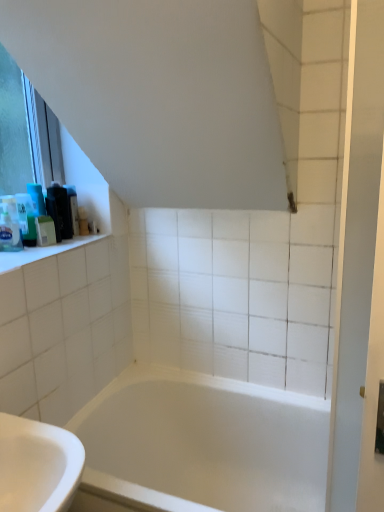
This screenshot has width=384, height=512. What do you see at coordinates (360, 274) in the screenshot? I see `white glossy screen door at right` at bounding box center [360, 274].

Find the location of a particular element. Image resolution: width=384 pixels, height=512 pixels. translucent plastic soap at upper left, which ranks as the first toiletry in front-to-back order is located at coordinates (9, 225).

Identify the location of white glossy bathtub at center. This screenshot has width=384, height=512. (201, 444).

Is the surface of white glossy screen door at right in direct contact with translucent plastic soap at upper left, the fifth toiletry when ordered from back to front?

No, white glossy screen door at right is not beside translucent plastic soap at upper left, the fifth toiletry when ordered from back to front.

Is white glossy screen door at right looking in the opposite direction of translucent plastic soap at upper left, the fifth toiletry when ordered from back to front?

white glossy screen door at right does not have its back to translucent plastic soap at upper left, the fifth toiletry when ordered from back to front.

Considering the sizes of white glossy screen door at right and translucent plastic soap at upper left, the fifth toiletry when ordered from back to front, in the image, is white glossy screen door at right bigger or smaller than translucent plastic soap at upper left, the fifth toiletry when ordered from back to front,?

Clearly, white glossy screen door at right is larger in size than translucent plastic soap at upper left, the fifth toiletry when ordered from back to front.

Considering the positions of objects white glossy screen door at right and translucent plastic soap at upper left, which ranks as the first toiletry in front-to-back order, in the image provided, who is more to the left, white glossy screen door at right or translucent plastic soap at upper left, which ranks as the first toiletry in front-to-back order,?

Positioned to the left is translucent plastic soap at upper left, which ranks as the first toiletry in front-to-back order.

Considering the positions of objects white glossy bathtub at center and matte black soap dispenser at upper left, the 5th toiletry in the front-to-back sequence, in the image provided, who is in front, white glossy bathtub at center or matte black soap dispenser at upper left, the 5th toiletry in the front-to-back sequence,?

white glossy bathtub at center is in front.

Consider the image. Could you tell me if white glossy bathtub at center is turned towards matte black soap dispenser at upper left, which appears as the first toiletry when viewed from the back?

No, white glossy bathtub at center does not turn towards matte black soap dispenser at upper left, which appears as the first toiletry when viewed from the back.

Do you think white glossy bathtub at center is within matte black soap dispenser at upper left, which appears as the first toiletry when viewed from the back, or outside of it?

white glossy bathtub at center is outside matte black soap dispenser at upper left, which appears as the first toiletry when viewed from the back.

Can you confirm if white glossy bathtub at center is bigger than matte black soap dispenser at upper left, the 5th toiletry in the front-to-back sequence?

Indeed, white glossy bathtub at center has a larger size compared to matte black soap dispenser at upper left, the 5th toiletry in the front-to-back sequence.

Who is smaller, translucent plastic soap at upper left, the fifth toiletry when ordered from back to front, or matte black soap dispenser at upper left, which appears as the first toiletry when viewed from the back?

matte black soap dispenser at upper left, which appears as the first toiletry when viewed from the back.

Does translucent plastic soap at upper left, the fifth toiletry when ordered from back to front, have a lesser width compared to matte black soap dispenser at upper left, which appears as the first toiletry when viewed from the back?

No.

How different are the orientations of translucent plastic soap at upper left, which ranks as the first toiletry in front-to-back order, and matte black soap dispenser at upper left, the 5th toiletry in the front-to-back sequence, in degrees?

The angular difference between translucent plastic soap at upper left, which ranks as the first toiletry in front-to-back order, and matte black soap dispenser at upper left, the 5th toiletry in the front-to-back sequence, is 0.0124 degrees.

From the picture: From a real-world perspective, is matte black soap dispenser at upper left, which appears as the first toiletry when viewed from the back, above or below black plastic container at upper left, marked as the 4th toiletry in a front-to-back arrangement?

From a real-world perspective, matte black soap dispenser at upper left, which appears as the first toiletry when viewed from the back, is physically below black plastic container at upper left, marked as the 4th toiletry in a front-to-back arrangement.

Is matte black soap dispenser at upper left, which appears as the first toiletry when viewed from the back, aimed at black plastic container at upper left, the second toiletry in the back-to-front sequence?

No, matte black soap dispenser at upper left, which appears as the first toiletry when viewed from the back, is not turned towards black plastic container at upper left, the second toiletry in the back-to-front sequence.

Is point (71, 192) closer to camera compared to point (56, 199)?

No.

Is matte black soap dispenser at upper left, the 5th toiletry in the front-to-back sequence, wider than black plastic container at upper left, marked as the 4th toiletry in a front-to-back arrangement?

No.

In the scene shown: From a real-world perspective, is green matte soap at left, which is the 4th toiletry from back to front, physically below matte black soap dispenser at upper left, which appears as the first toiletry when viewed from the back?

Indeed, from a real-world perspective, green matte soap at left, which is the 4th toiletry from back to front, is positioned beneath matte black soap dispenser at upper left, which appears as the first toiletry when viewed from the back.

Can you confirm if green matte soap at left, which is the 4th toiletry from back to front, is thinner than matte black soap dispenser at upper left, which appears as the first toiletry when viewed from the back?

No.

Is green matte soap at left, the 2th toiletry when ordered from front to back, next to matte black soap dispenser at upper left, which appears as the first toiletry when viewed from the back, and touching it?

green matte soap at left, the 2th toiletry when ordered from front to back, is not next to matte black soap dispenser at upper left, which appears as the first toiletry when viewed from the back, and they're not touching.

From the image's perspective, which is below, green matte soap at left, which is the 4th toiletry from back to front, or matte black soap dispenser at upper left, which appears as the first toiletry when viewed from the back?

From the image's view, green matte soap at left, which is the 4th toiletry from back to front, is below.

Does translucent plastic bottle at left, marked as the third toiletry in a back-to-front arrangement, appear on the right side of white glossy screen door at right?

No, translucent plastic bottle at left, marked as the third toiletry in a back-to-front arrangement, is not to the right of white glossy screen door at right.

From the white glossy screen door at right, count 3rd toiletrys backward and point to it. Please provide its 2D coordinates.

[(26, 219)]

From a real-world perspective, between translucent plastic bottle at left, the third toiletry positioned from the front, and white glossy screen door at right, who is vertically lower?

From a 3D spatial view, white glossy screen door at right is below.

Are translucent plastic bottle at left, marked as the third toiletry in a back-to-front arrangement, and white glossy screen door at right far apart?

Absolutely, translucent plastic bottle at left, marked as the third toiletry in a back-to-front arrangement, is distant from white glossy screen door at right.

Which object is more forward, matte black soap dispenser at upper left, which appears as the first toiletry when viewed from the back, or white glossy screen door at right?

white glossy screen door at right.

Locate an element on the screen. The height and width of the screenshot is (512, 384). screen door in front of the matte black soap dispenser at upper left, the 5th toiletry in the front-to-back sequence is located at coordinates (360, 274).

Is matte black soap dispenser at upper left, the 5th toiletry in the front-to-back sequence, not inside white glossy screen door at right?

Absolutely, matte black soap dispenser at upper left, the 5th toiletry in the front-to-back sequence, is external to white glossy screen door at right.

Between point (73, 223) and point (372, 497), which one is positioned in front?

Positioned in front is point (372, 497).

From a real-world perspective, count 2nd toiletrys upward from the white glossy screen door at right and point to it. Please provide its 2D coordinates.

[(9, 225)]

Which toiletry is the 5th one when counting from the back of the white glossy bathtub at center? Please provide its 2D coordinates.

[(72, 207)]

Estimate the real-world distances between objects in this image. Which object is further from translucent plastic bottle at left, marked as the third toiletry in a back-to-front arrangement, translucent plastic soap at upper left, which ranks as the first toiletry in front-to-back order, or white glossy bathtub at center?

white glossy bathtub at center is positioned further to the anchor translucent plastic bottle at left, marked as the third toiletry in a back-to-front arrangement.

From the image, which object appears to be nearer to white glossy screen door at right, black plastic container at upper left, the second toiletry in the back-to-front sequence, or translucent plastic bottle at left, marked as the third toiletry in a back-to-front arrangement?

The object closer to white glossy screen door at right is translucent plastic bottle at left, marked as the third toiletry in a back-to-front arrangement.

From the image, which object appears to be farther from translucent plastic bottle at left, the third toiletry positioned from the front, green matte soap at left, the 2th toiletry when ordered from front to back, or white glossy screen door at right?

Based on the image, white glossy screen door at right appears to be further to translucent plastic bottle at left, the third toiletry positioned from the front.

Considering their positions, is translucent plastic soap at upper left, the fifth toiletry when ordered from back to front, positioned further to green matte soap at left, which is the 4th toiletry from back to front, than white glossy bathtub at center?

Based on the image, white glossy bathtub at center appears to be further to green matte soap at left, which is the 4th toiletry from back to front.

Based on their spatial positions, is translucent plastic soap at upper left, the fifth toiletry when ordered from back to front, or matte black soap dispenser at upper left, which appears as the first toiletry when viewed from the back, further from white glossy bathtub at center?

translucent plastic soap at upper left, the fifth toiletry when ordered from back to front.

From the image, which object appears to be farther from white glossy bathtub at center, white glossy screen door at right or matte black soap dispenser at upper left, the 5th toiletry in the front-to-back sequence?

The object further to white glossy bathtub at center is matte black soap dispenser at upper left, the 5th toiletry in the front-to-back sequence.

Based on their spatial positions, is white glossy screen door at right or white glossy bathtub at center closer to translucent plastic bottle at left, marked as the third toiletry in a back-to-front arrangement?

The object closer to translucent plastic bottle at left, marked as the third toiletry in a back-to-front arrangement, is white glossy bathtub at center.

Considering their positions, is green matte soap at left, the 2th toiletry when ordered from front to back, positioned further to white glossy screen door at right than translucent plastic bottle at left, the third toiletry positioned from the front?

The object further to white glossy screen door at right is translucent plastic bottle at left, the third toiletry positioned from the front.

Find the location of `screen door between green matte soap at left, the 2th toiletry when ordered from front to back, and white glossy bathtub at center vertically`. screen door between green matte soap at left, the 2th toiletry when ordered from front to back, and white glossy bathtub at center vertically is located at coordinates (360, 274).

At what (x,y) coordinates should I click in order to perform the action: click on toiletry between green matte soap at left, the 2th toiletry when ordered from front to back, and black plastic container at upper left, the second toiletry in the back-to-front sequence, from front to back. Please return your answer as a coordinate pair (x, y). The width and height of the screenshot is (384, 512). Looking at the image, I should click on (26, 219).

You are a GUI agent. You are given a task and a screenshot of the screen. Output one action in this format:
    pyautogui.click(x=<x>, y=<y>)
    Task: Click on the toiletry between translucent plastic bottle at left, the third toiletry positioned from the front, and matte black soap dispenser at upper left, the 5th toiletry in the front-to-back sequence, along the z-axis
    
    Given the screenshot: What is the action you would take?
    pyautogui.click(x=59, y=211)

Locate an element on the screen. This screenshot has width=384, height=512. screen door between matte black soap dispenser at upper left, which appears as the first toiletry when viewed from the back, and white glossy bathtub at center from top to bottom is located at coordinates (360, 274).